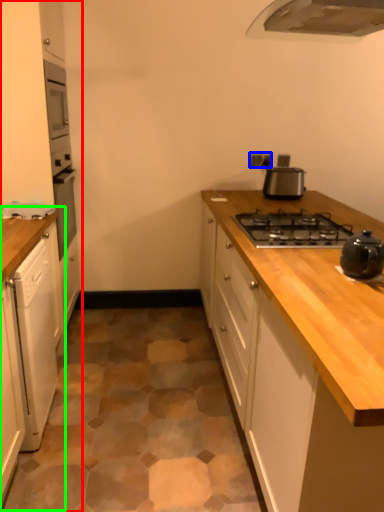
Question: Which is nearer to the cabinetry (highlighted by a red box)? electric outlet (highlighted by a blue box) or cabinetry (highlighted by a green box).

Choices:
 (A) electric outlet
 (B) cabinetry

Answer: (B)